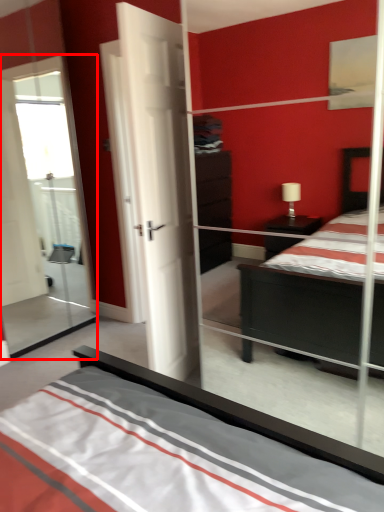
Question: From the image's perspective, what is the correct spatial relationship of glass door (annotated by the red box) in relation to door?

Choices:
 (A) below
 (B) above

Answer: (B)